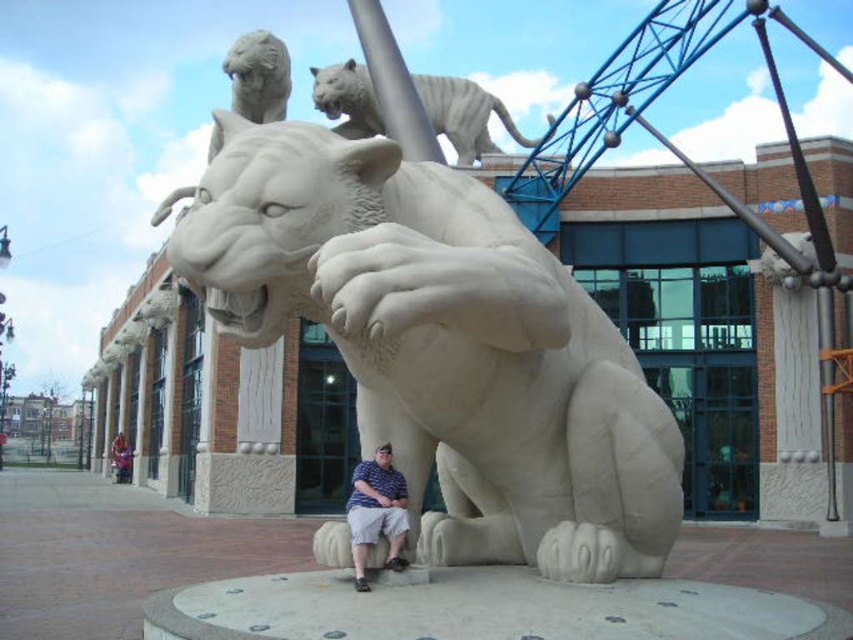
From the picture: You are a photographer standing in the plaza and want to take a picture of the striped shirt at center and the white marble tiger at upper center. Which object should you focus on first if you want to capture both in the same frame without moving the camera?

The striped shirt at center should be focused on first because the white marble tiger at upper center is positioned to its right, so adjusting focus from the center towards the right would include both in the frame.

Based on the photo, you are standing in the plaza and want to take a photo of the white marble tiger at upper center without the striped shirt at center appearing in the frame. Which object should you position closer to the camera to achieve this?

To avoid the striped shirt at center in the photo, position yourself closer to the white marble tiger at upper center since it is already further forward than the striped shirt at center. This will make the tiger larger in the frame and obscure the shirt behind it.